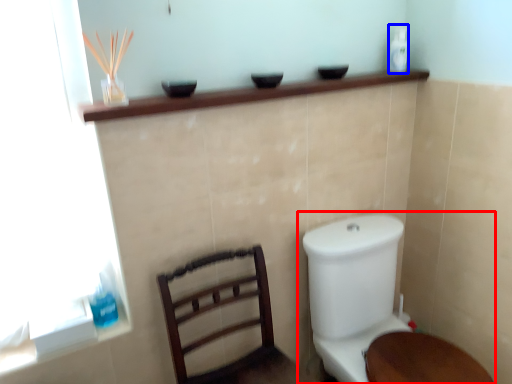
Question: Which object is further to the camera taking this photo, toilet (highlighted by a red box) or toiletry (highlighted by a blue box)?

Choices:
 (A) toilet
 (B) toiletry

Answer: (B)